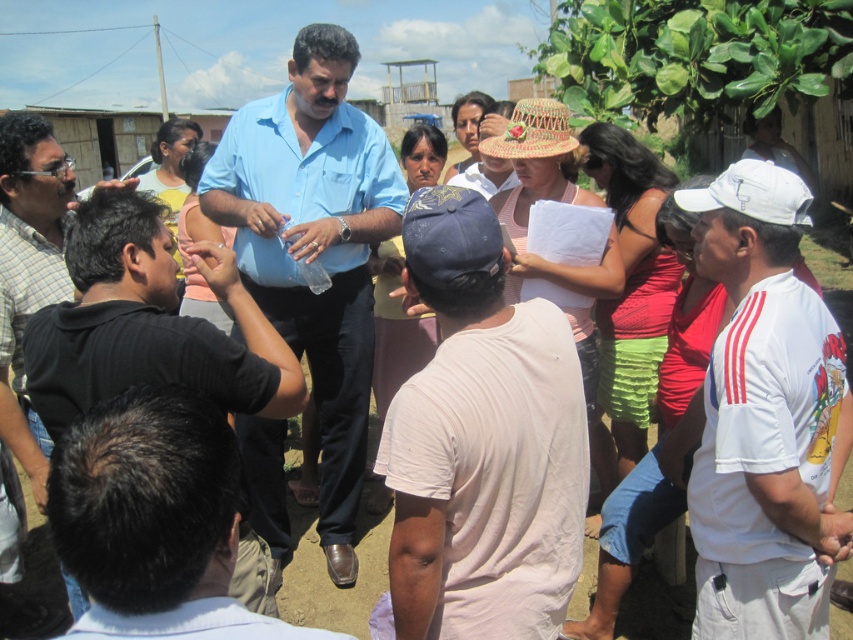
Which is above, white fabric shirt at right or brown woven straw hat at center?

brown woven straw hat at center is above.

Is white fabric shirt at right further to camera compared to brown woven straw hat at center?

No, it is in front of brown woven straw hat at center.

Who is more forward, (683, 192) or (537, 112)?

Positioned in front is point (683, 192).

In order to click on white fabric shirt at right in this screenshot , I will do `click(766, 419)`.

Looking at this image, can you confirm if dark brown hair at lower left is positioned to the left of black shirt at lower left?

Incorrect, dark brown hair at lower left is not on the left side of black shirt at lower left.

From the picture: Can you confirm if dark brown hair at lower left is positioned below black shirt at lower left?

No.

Between point (137, 484) and point (49, 152), which one is positioned behind?

The point (49, 152) is behind.

At what (x,y) coordinates should I click in order to perform the action: click on dark brown hair at lower left. Please return your answer as a coordinate pair (x, y). Looking at the image, I should click on (154, 518).

Which of these two, brown woven straw hat at center or matte blue shirt at center, stands shorter?

With less height is brown woven straw hat at center.

Can you confirm if brown woven straw hat at center is taller than matte blue shirt at center?

Incorrect, brown woven straw hat at center's height is not larger of matte blue shirt at center's.

Does point (515, 134) come in front of point (461, 116)?

Yes, point (515, 134) is closer to viewer.

In order to click on brown woven straw hat at center in this screenshot , I will do `click(532, 131)`.